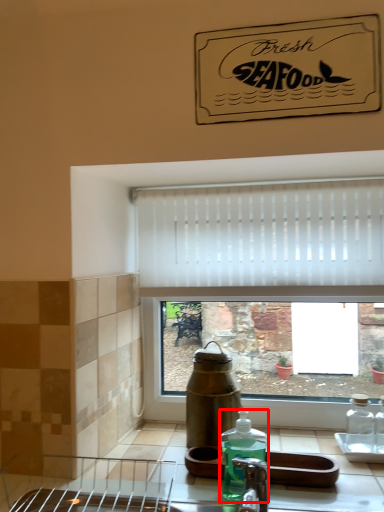
Question: From the image's perspective, where is bottle (annotated by the red box) located in relation to curtain in the image?

Choices:
 (A) above
 (B) below

Answer: (B)